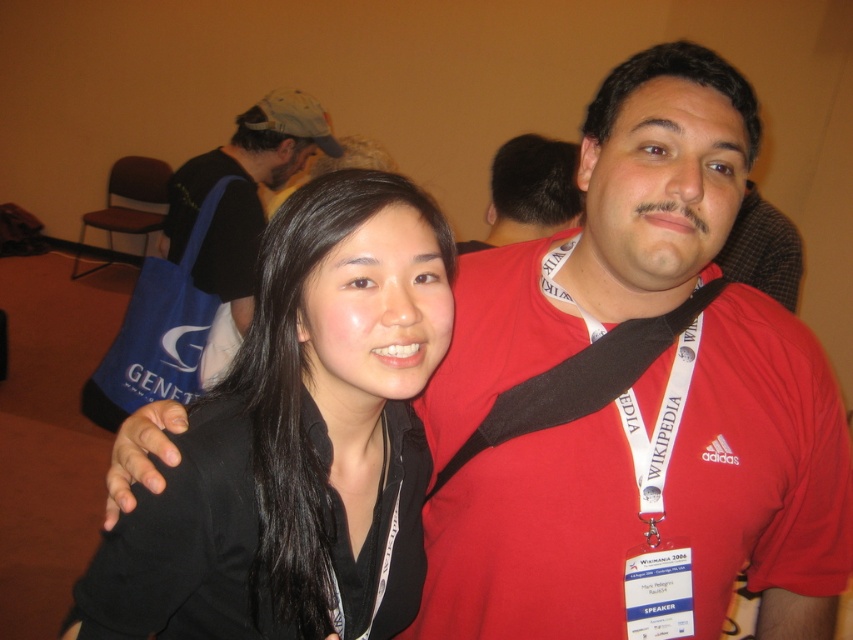
Question: Is black matte/black hair at center bigger than red matte shirt at upper right?

Choices:
 (A) yes
 (B) no

Answer: (B)

Question: Considering the real-world distances, which object is farthest from the black t-shirt at center?

Choices:
 (A) black matte/black hair at center
 (B) red matte shirt at upper right

Answer: (A)

Question: Based on their relative distances, which object is farther from the black t-shirt at center?

Choices:
 (A) red matte shirt at upper right
 (B) black matte/black hair at center

Answer: (B)

Question: Is the position of black matte/black hair at center less distant than that of red matte shirt at upper right?

Choices:
 (A) yes
 (B) no

Answer: (A)

Question: Which point is closer to the camera?

Choices:
 (A) black matte/black hair at center
 (B) black t-shirt at center
 (C) red matte shirt at upper right

Answer: (A)

Question: Does black matte/black hair at center appear under black t-shirt at center?

Choices:
 (A) yes
 (B) no

Answer: (A)